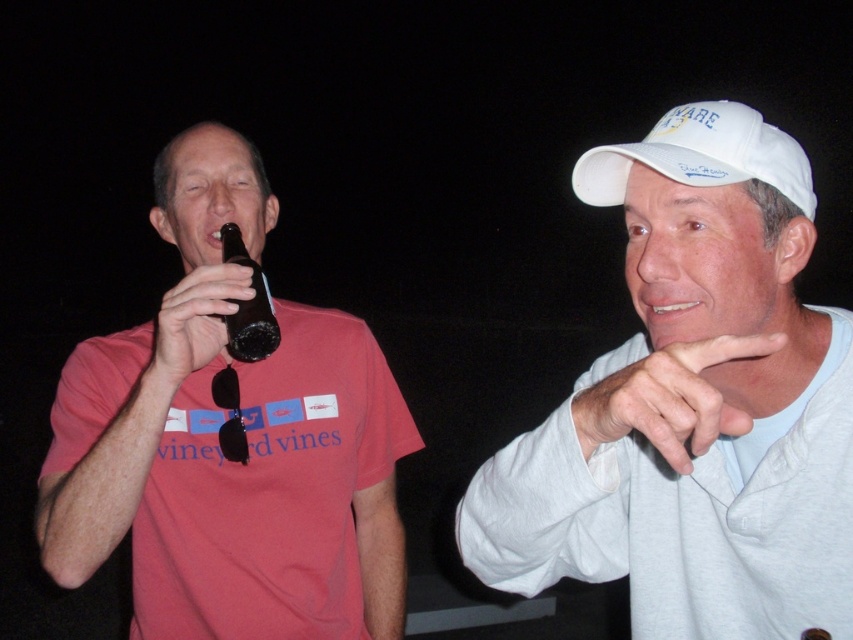
Is point (704, 573) positioned before point (228, 257)?

Yes.

Image resolution: width=853 pixels, height=640 pixels. I want to click on white matte cap at upper right, so click(693, 404).

Describe the element at coordinates (693, 404) in the screenshot. This screenshot has height=640, width=853. I see `white matte cap at upper right` at that location.

The width and height of the screenshot is (853, 640). I want to click on white matte cap at upper right, so (693, 404).

Who is positioned more to the right, matte black beer bottle at left or dark brown glass bottle at left?

From the viewer's perspective, matte black beer bottle at left appears more on the right side.

Can you confirm if matte black beer bottle at left is shorter than dark brown glass bottle at left?

No.

Does point (355, 381) come farther from viewer compared to point (254, 312)?

Yes.

At what (x,y) coordinates should I click in order to perform the action: click on matte black beer bottle at left. Please return your answer as a coordinate pair (x, y). The width and height of the screenshot is (853, 640). Looking at the image, I should click on (216, 445).

What do you see at coordinates (216, 445) in the screenshot?
I see `matte black beer bottle at left` at bounding box center [216, 445].

Between point (164, 376) and point (793, 202), which one is positioned in front?

Positioned in front is point (793, 202).

Locate an element on the screen. The width and height of the screenshot is (853, 640). matte black beer bottle at left is located at coordinates (216, 445).